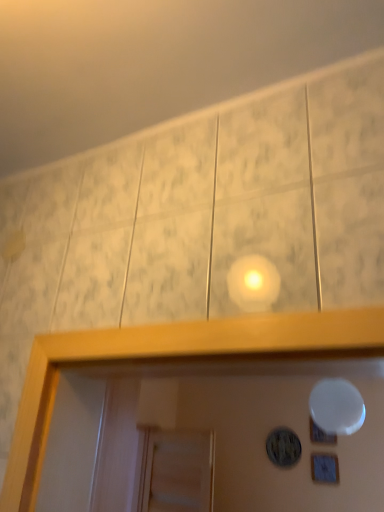
Question: Considering the relative sizes of wooden frame at lower right and white glossy mirror at upper center in the image provided, is wooden frame at lower right shorter than white glossy mirror at upper center?

Choices:
 (A) no
 (B) yes

Answer: (B)

Question: From a real-world perspective, is wooden frame at lower right physically above white glossy mirror at upper center?

Choices:
 (A) no
 (B) yes

Answer: (A)

Question: Considering the relative positions of wooden frame at lower right and white glossy mirror at upper center in the image provided, is wooden frame at lower right to the right of white glossy mirror at upper center from the viewer's perspective?

Choices:
 (A) yes
 (B) no

Answer: (A)

Question: Can you confirm if wooden frame at lower right is taller than white glossy mirror at upper center?

Choices:
 (A) yes
 (B) no

Answer: (B)

Question: Is wooden frame at lower right closer to camera compared to white glossy mirror at upper center?

Choices:
 (A) no
 (B) yes

Answer: (A)

Question: Does wooden frame at lower right have a greater width compared to white glossy mirror at upper center?

Choices:
 (A) yes
 (B) no

Answer: (B)

Question: Considering the relative sizes of wooden frame at lower right and matte black circular object at center, marked as the 2th dot in a right-to-left arrangement, in the image provided, is wooden frame at lower right taller than matte black circular object at center, marked as the 2th dot in a right-to-left arrangement,?

Choices:
 (A) yes
 (B) no

Answer: (B)

Question: Is wooden frame at lower right outside matte black circular object at center, which is the first dot in left-to-right order?

Choices:
 (A) no
 (B) yes

Answer: (B)

Question: Is wooden frame at lower right beside matte black circular object at center, which is the first dot in left-to-right order?

Choices:
 (A) no
 (B) yes

Answer: (A)

Question: From the image's perspective, is wooden frame at lower right located above matte black circular object at center, marked as the 2th dot in a right-to-left arrangement?

Choices:
 (A) yes
 (B) no

Answer: (B)

Question: Is the position of wooden frame at lower right less distant than that of matte black circular object at center, marked as the 2th dot in a right-to-left arrangement?

Choices:
 (A) yes
 (B) no

Answer: (A)

Question: Does wooden frame at lower right appear on the left side of matte black circular object at center, marked as the 2th dot in a right-to-left arrangement?

Choices:
 (A) no
 (B) yes

Answer: (A)

Question: Considering the relative sizes of white glossy mirror at upper center and wooden frame at lower right in the image provided, is white glossy mirror at upper center thinner than wooden frame at lower right?

Choices:
 (A) no
 (B) yes

Answer: (A)